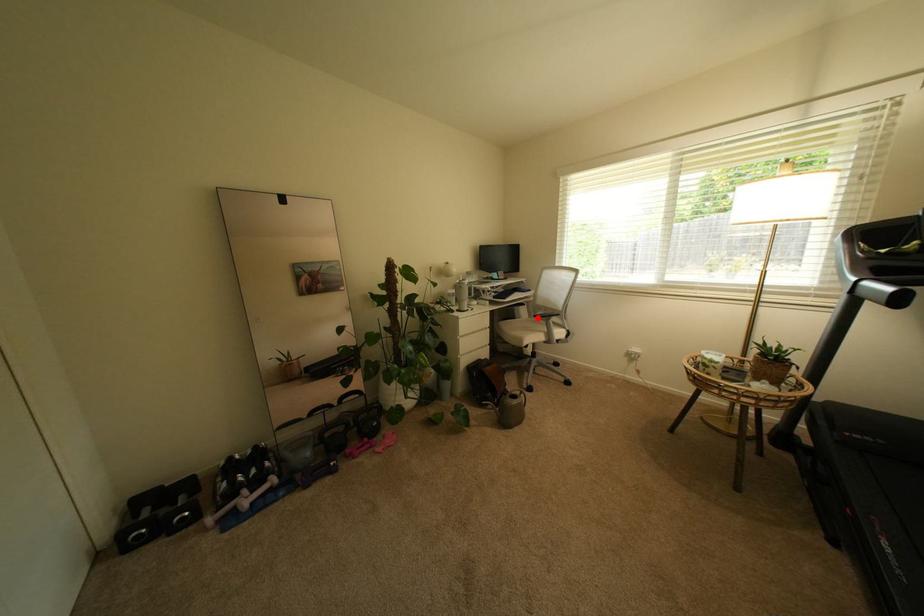
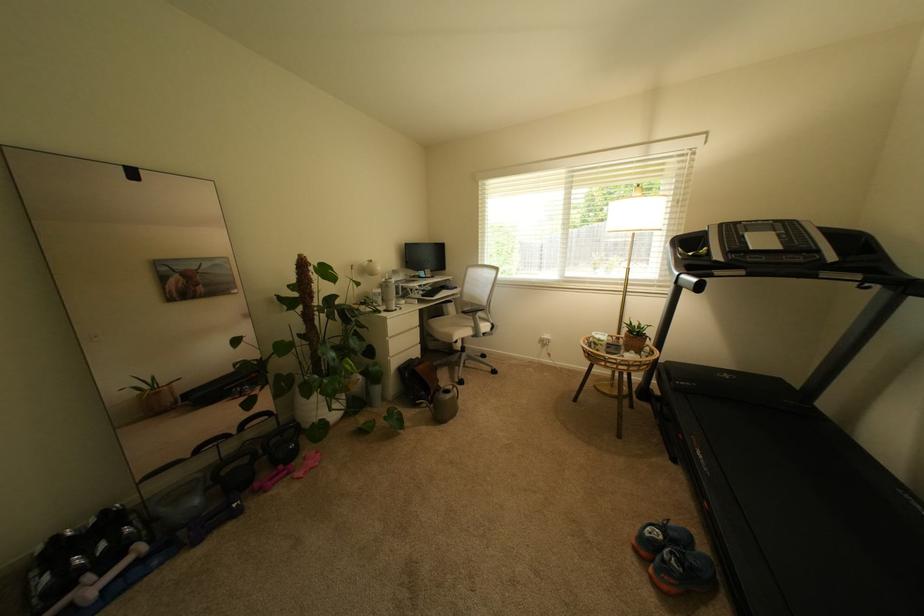
Where in the second image is the point corresponding to the highlighted location from the first image?

(466, 314)